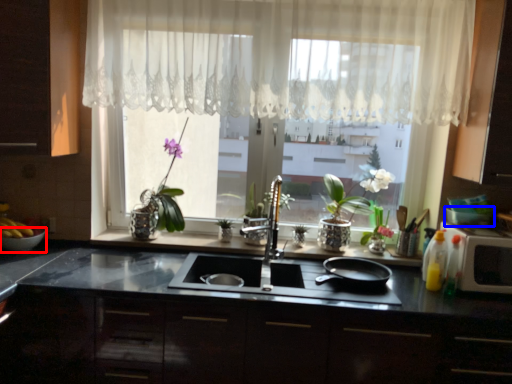
Question: Which object is further to the camera taking this photo, glass bowl (highlighted by a red box) or glass bowl (highlighted by a blue box)?

Choices:
 (A) glass bowl
 (B) glass bowl

Answer: (A)